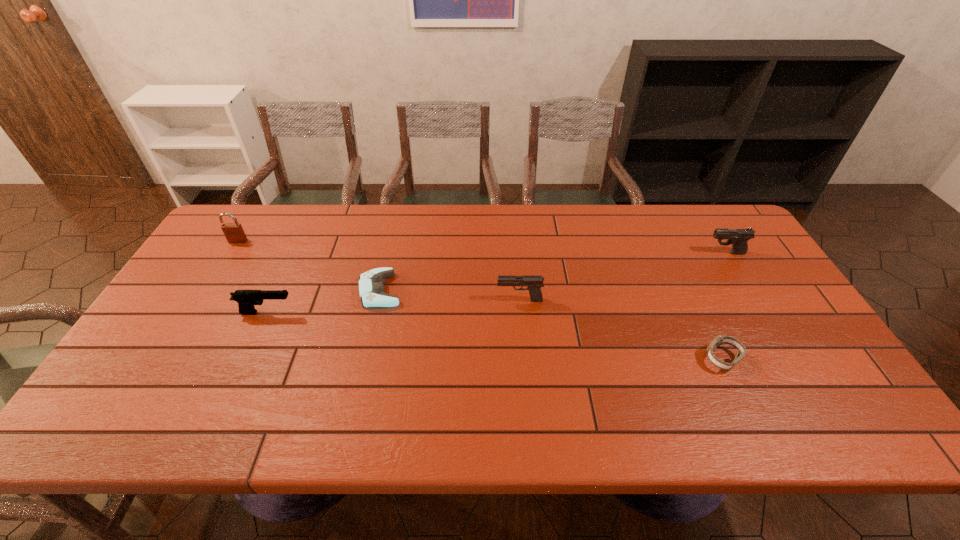
Where is `the leftmost object`? the leftmost object is located at coordinates tap(234, 233).

Identify the location of the farthest object. (234, 233).

Identify the location of the farthest pistol. (738, 237).

Find the location of a particular element. the fifth nearest object is located at coordinates (738, 237).

At what (x,y) coordinates should I click in order to perform the action: click on the fourth object from left to right. Please return your answer as a coordinate pair (x, y). Image resolution: width=960 pixels, height=540 pixels. Looking at the image, I should click on (534, 282).

Identify the location of the second pistol from right to left. The image size is (960, 540). (534, 282).

Identify the location of the nearest pistol. (246, 299).

The image size is (960, 540). Identify the location of the fifth object from right to left. (246, 299).

You are a GUI agent. You are given a task and a screenshot of the screen. Output one action in this format:
    pyautogui.click(x=<x>, y=<y>)
    Task: Click on the second object from right to left
    This screenshot has height=540, width=960.
    Given the screenshot: What is the action you would take?
    pyautogui.click(x=720, y=339)

What are the coordinates of `the nearest object` in the screenshot? It's located at (720, 339).